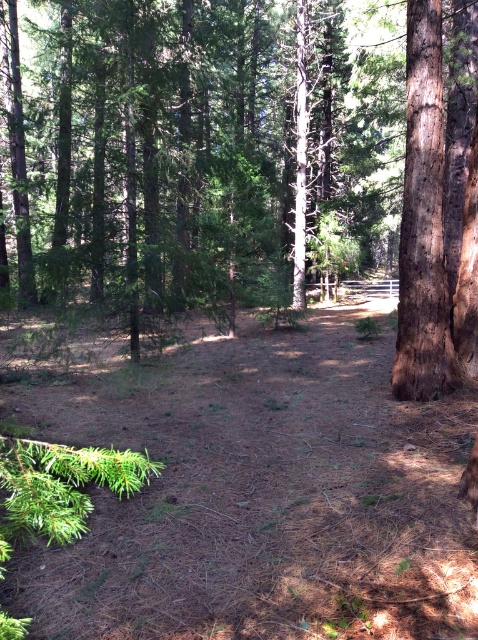
Question: Which point is farther to the camera?

Choices:
 (A) (161, 129)
 (B) (426, 152)

Answer: (A)

Question: Does brown textured tree at center appear on the left side of brown rough bark tree at right?

Choices:
 (A) no
 (B) yes

Answer: (B)

Question: Does brown textured tree at center have a smaller size compared to brown rough bark tree at right?

Choices:
 (A) no
 (B) yes

Answer: (A)

Question: Is brown textured tree at center behind brown rough bark tree at right?

Choices:
 (A) yes
 (B) no

Answer: (B)

Question: Which point is farther from the camera taking this photo?

Choices:
 (A) (403, 296)
 (B) (365, 58)

Answer: (B)

Question: Which object appears farthest from the camera in this image?

Choices:
 (A) brown textured tree at center
 (B) brown rough bark tree at right

Answer: (B)